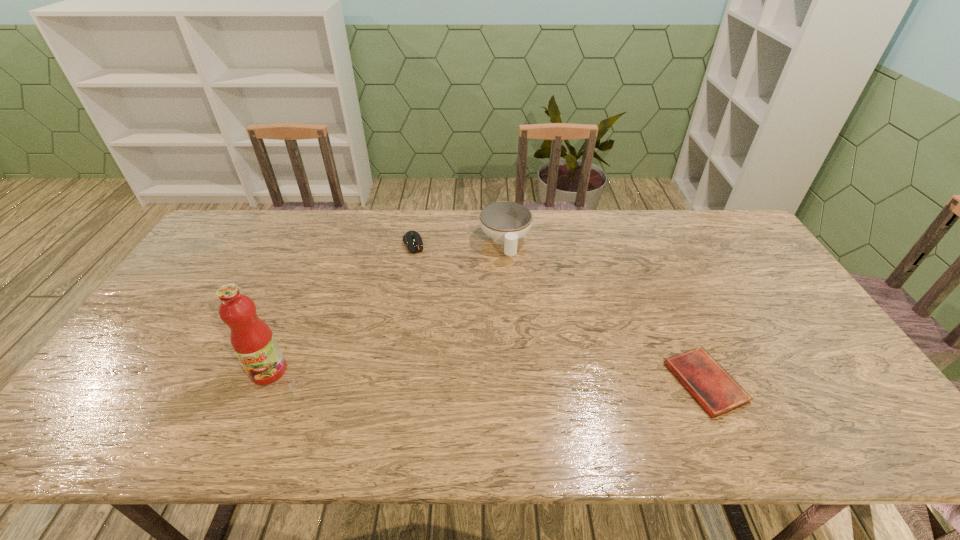
Locate an element on the screen. This screenshot has height=540, width=960. free space between the third object from left to right and the diary is located at coordinates (605, 313).

Identify the location of free area in between the second object from right to left and the diary. (605, 313).

I want to click on empty space that is in between the tallest object and the rightmost object, so click(487, 377).

Find the location of a particular element. the third closest object to the rightmost object is located at coordinates (252, 340).

I want to click on object that is the nearest to the tallest object, so click(413, 240).

Locate an element on the screen. This screenshot has height=540, width=960. free region that satisfies the following two spatial constraints: 1. on the front label of the shortest object; 2. on the left side of the leftmost object is located at coordinates (263, 382).

Image resolution: width=960 pixels, height=540 pixels. Identify the location of vacant space that satisfies the following two spatial constraints: 1. on the front label of the diary; 2. on the right side of the tallest object. (263, 382).

Locate an element on the screen. The image size is (960, 540). free spot that satisfies the following two spatial constraints: 1. on the front label of the fruit juice; 2. on the right side of the diary is located at coordinates click(x=263, y=382).

Identify the location of free location that satisfies the following two spatial constraints: 1. on the front label of the tallest object; 2. on the right side of the rightmost object. (263, 382).